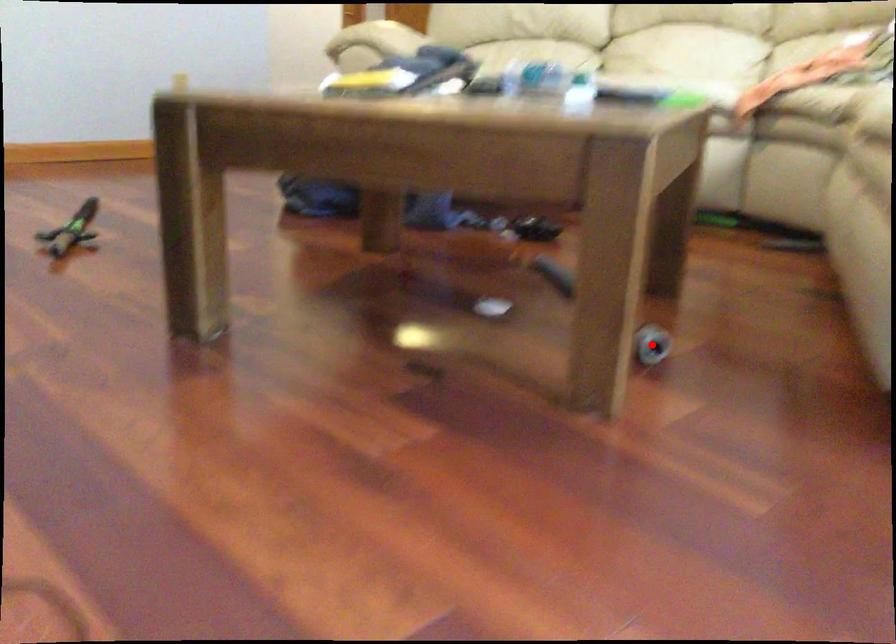
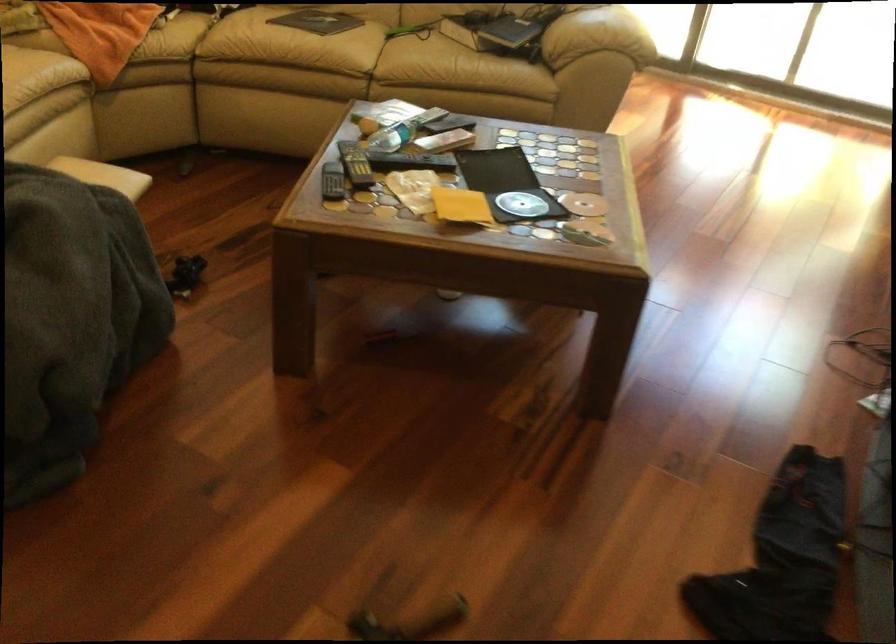
Question: I am providing you with two images of the same scene from different viewpoints. A red point is marked on the first image. At the location where the point appears in image 1, is it still visible in image 2?

Choices:
 (A) Yes
 (B) No

Answer: (B)